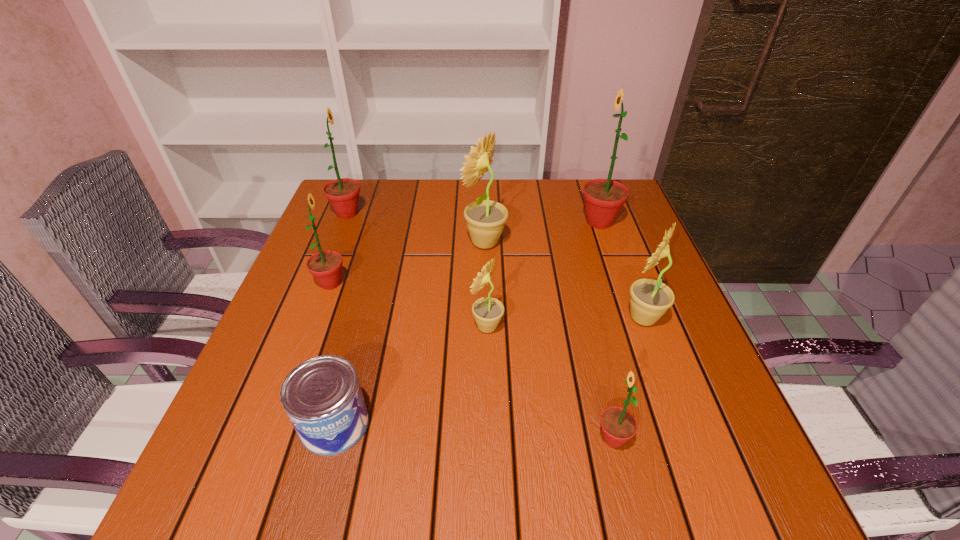
The height and width of the screenshot is (540, 960). Find the location of `the shortest object`. the shortest object is located at coordinates (322, 396).

Where is `can`? The height and width of the screenshot is (540, 960). can is located at coordinates (322, 396).

Find the location of `vacant point located on the face of the tallest object`. vacant point located on the face of the tallest object is located at coordinates (471, 222).

Locate an element on the screen. The height and width of the screenshot is (540, 960). vacant position located 0.270m on the face of the tallest object is located at coordinates (479, 222).

Locate an element on the screen. The image size is (960, 540). vacant space positioned on the face of the tallest object is located at coordinates (479, 222).

Identify the location of free spot located 0.250m on the face of the biggest yellow sunflower. Image resolution: width=960 pixels, height=540 pixels. (366, 242).

Identify the location of vacant point located 0.300m on the face of the biggest yellow sunflower. The image size is (960, 540). tap(347, 242).

Identify the location of free space located 0.220m on the face of the biggest yellow sunflower. This screenshot has width=960, height=540. (377, 242).

At what (x,y) coordinates should I click in order to perform the action: click on free point located 0.360m on the face of the second biggest green sunflower. Please return your answer as a coordinate pair (x, y). Looking at the image, I should click on (493, 213).

Identify the location of vacant space located 0.120m on the face of the second smallest yellow sunflower. [x=565, y=318].